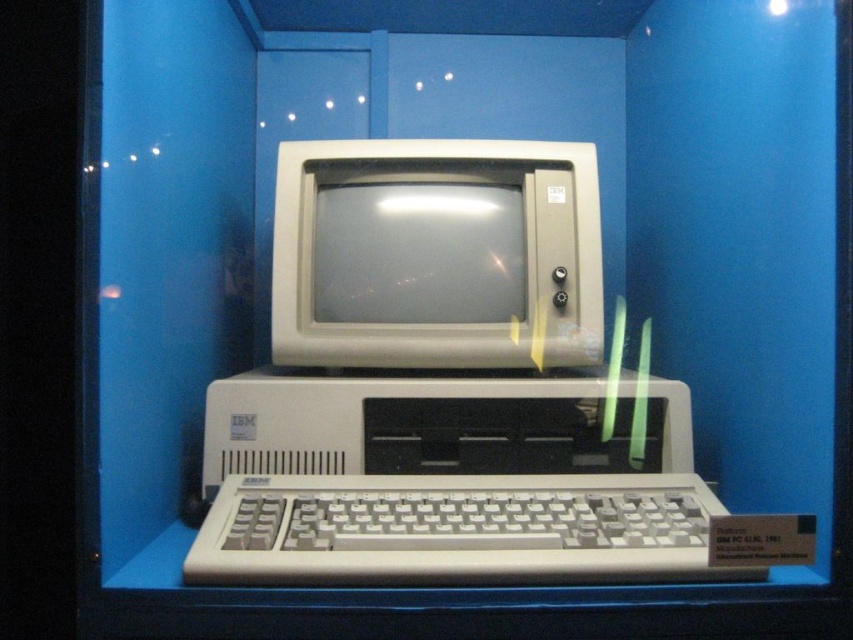
You are a museum visitor standing in front of the vintage IBM PC display. You notice the beige plastic monitor at center and the white plastic keyboard at center. Which object is located to the left of the other?

The beige plastic monitor at center is positioned on the left side of white plastic keyboard at center.

Based on the photo, you are standing in front of the glass case containing the vintage IBM PC. There is a point labeled at coordinates (436, 253). Which object in the case does this point correspond to?

The point corresponds to the beige plastic monitor at center.